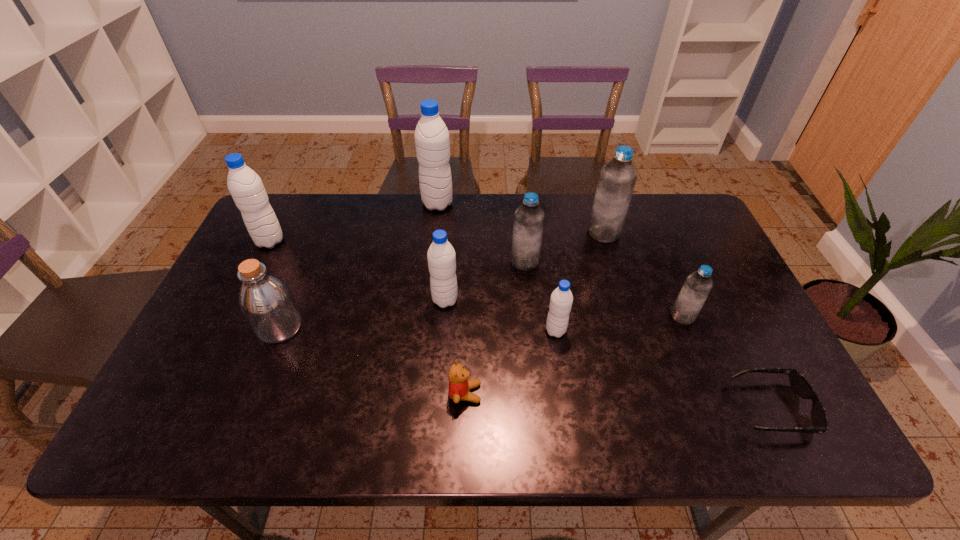
Find the location of a particular element. This screenshot has height=540, width=960. vacant space at the right edge of the desktop is located at coordinates (727, 318).

This screenshot has height=540, width=960. I want to click on vacant area between the red teddy bear and the fourth farthest water bottle, so click(495, 327).

At what (x,y) coordinates should I click in order to perform the action: click on empty space that is in between the rightmost water bottle and the rightmost object. Please return your answer as a coordinate pair (x, y). The width and height of the screenshot is (960, 540). Looking at the image, I should click on (727, 362).

The image size is (960, 540). What are the coordinates of `empty location between the third object from right to left and the rightmost blue water bottle` in the screenshot? It's located at (643, 274).

What are the coordinates of `free space between the smallest gray water bottle and the second farthest blue water bottle` in the screenshot? It's located at (540, 296).

This screenshot has height=540, width=960. Identify the location of free space between the shortest object and the fourth farthest water bottle. (648, 334).

The height and width of the screenshot is (540, 960). Find the location of `free spot between the black sunglasses and the second nearest gray water bottle`. free spot between the black sunglasses and the second nearest gray water bottle is located at coordinates (609, 354).

At what (x,y) coordinates should I click in order to perform the action: click on empty location between the second blue water bottle from right to left and the nearest gray water bottle. Please return your answer as a coordinate pair (x, y). Looking at the image, I should click on (580, 282).

Choose which object is the second nearest neighbor to the red teddy bear. Please provide its 2D coordinates. Your answer should be formatted as a tuple, i.e. [(x, y)], where the tuple contains the x and y coordinates of a point satisfying the conditions above.

[(441, 256)]

This screenshot has height=540, width=960. What are the coordinates of `object that is the third nearest to the farthest gray water bottle` in the screenshot? It's located at (245, 186).